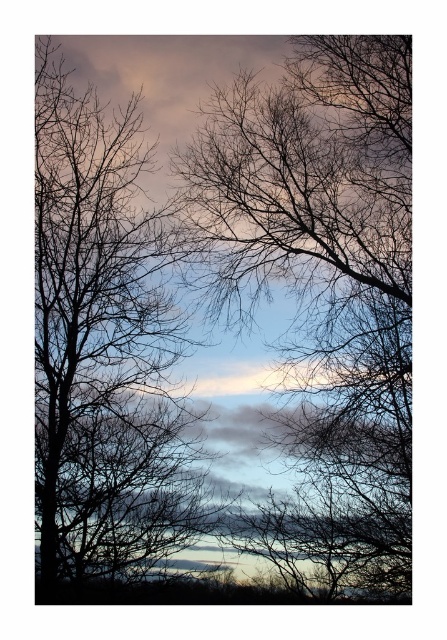
Does silhouette branches at center have a larger size compared to silhouette bare tree at left?

Incorrect, silhouette branches at center is not larger than silhouette bare tree at left.

Does silhouette branches at center have a greater width compared to silhouette bare tree at left?

Incorrect, silhouette branches at center's width does not surpass silhouette bare tree at left's.

Which is behind, point (383, 561) or point (42, 582)?

The point (383, 561) is behind.

Image resolution: width=447 pixels, height=640 pixels. In order to click on silhouette branches at center in this screenshot , I will do `click(320, 291)`.